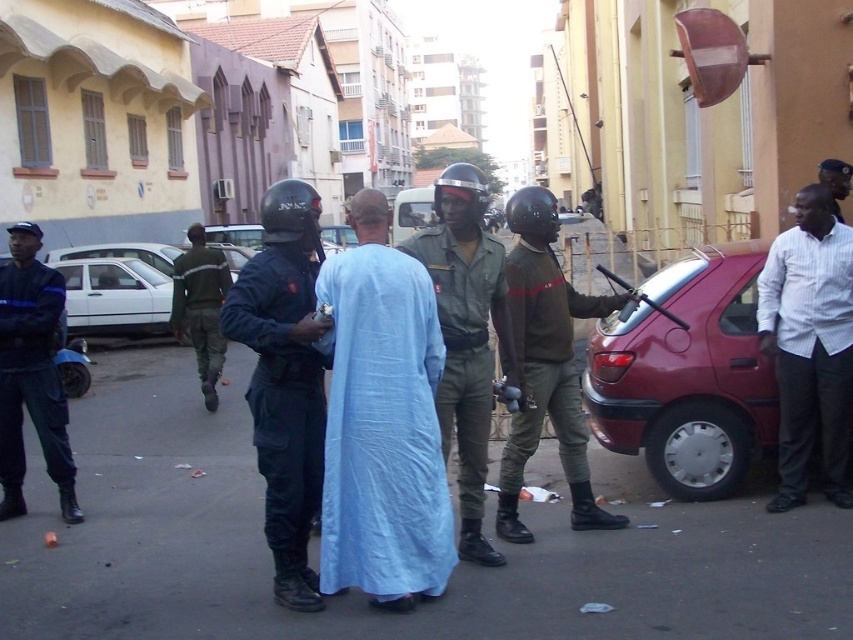
Question: Is white striped shirt at right below dark blue uniform at left?

Choices:
 (A) yes
 (B) no

Answer: (B)

Question: Based on their relative distances, which object is farther from the green uniform at center?

Choices:
 (A) white matte car at left
 (B) dark blue uniform at left
 (C) metallic red car at right

Answer: (A)

Question: Does dark blue uniform at center have a smaller size compared to white matte car at left?

Choices:
 (A) yes
 (B) no

Answer: (A)

Question: Which point is farther from the camera taking this photo?

Choices:
 (A) (16, 406)
 (B) (221, 339)
 (C) (587, 481)

Answer: (B)

Question: Which object appears closest to the camera in this image?

Choices:
 (A) dark brown leather jacket at center
 (B) white matte car at left
 (C) dark blue uniform at left

Answer: (A)

Question: Where is metallic red car at right located in relation to dark brown leather jacket at center in the image?

Choices:
 (A) right
 (B) left

Answer: (A)